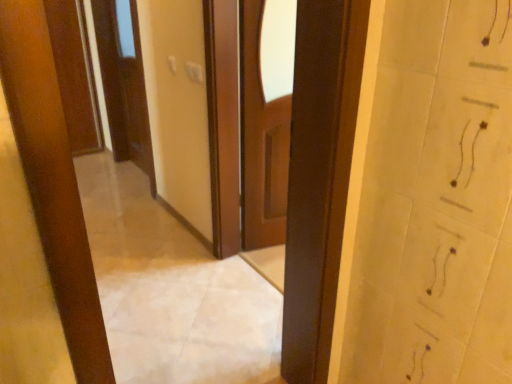
Question: Considering the positions of wooden door at upper left, which ranks as the 1th door in left-to-right order, and matte brown door at upper left, which ranks as the second door in left-to-right order, in the image, is wooden door at upper left, which ranks as the 1th door in left-to-right order, bigger or smaller than matte brown door at upper left, which ranks as the second door in left-to-right order,?

Choices:
 (A) big
 (B) small

Answer: (B)

Question: Would you say wooden door at upper left, the 2th door positioned from the right, is to the left or to the right of matte brown door at upper left, which ranks as the second door in left-to-right order, in the picture?

Choices:
 (A) right
 (B) left

Answer: (B)

Question: Is wooden door at upper left, the 2th door positioned from the right, inside or outside of matte brown door at upper left, which ranks as the second door in left-to-right order?

Choices:
 (A) inside
 (B) outside

Answer: (B)

Question: Does point (126, 96) appear closer or farther from the camera than point (58, 56)?

Choices:
 (A) farther
 (B) closer

Answer: (B)

Question: From the image's perspective, is matte brown door at upper left, the 1th door from the right, above or below wooden door at upper left, the 2th door positioned from the right?

Choices:
 (A) above
 (B) below

Answer: (B)

Question: From their relative heights in the image, would you say matte brown door at upper left, the 1th door from the right, is taller or shorter than wooden door at upper left, the 2th door positioned from the right?

Choices:
 (A) short
 (B) tall

Answer: (B)

Question: Considering the relative positions of matte brown door at upper left, which ranks as the second door in left-to-right order, and wooden door at upper left, which ranks as the 1th door in left-to-right order, in the image provided, is matte brown door at upper left, which ranks as the second door in left-to-right order, to the left or to the right of wooden door at upper left, which ranks as the 1th door in left-to-right order,?

Choices:
 (A) right
 (B) left

Answer: (A)